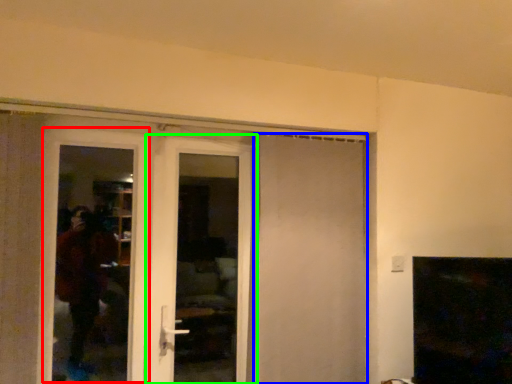
Question: Considering the real-world distances, which object is closest to screen door (highlighted by a red box)? door (highlighted by a blue box) or door (highlighted by a green box).

Choices:
 (A) door
 (B) door

Answer: (B)